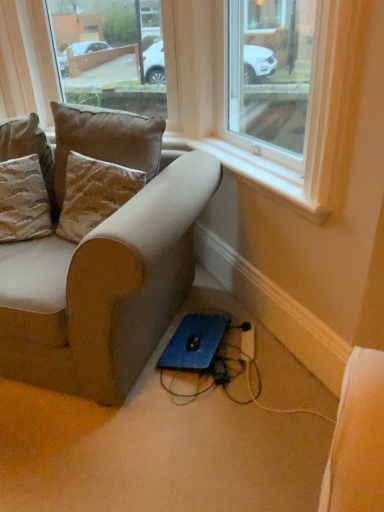
This screenshot has width=384, height=512. Describe the element at coordinates (257, 174) in the screenshot. I see `white plastic window sill at upper center` at that location.

Describe the element at coordinates (105, 140) in the screenshot. I see `velvet brown pillow at upper left, which is counted as the second pillow, starting from the left` at that location.

Locate an element on the screen. This screenshot has width=384, height=512. velvet brown pillow at upper left, which is counted as the second pillow, starting from the left is located at coordinates (105, 140).

Measure the distance between blue matte laptop at lower center and camera.

1.77 meters.

The image size is (384, 512). Identify the location of blue matte laptop at lower center. (194, 342).

From the picture: Measure the distance between point (289, 65) and camera.

They are 3.35 meters apart.

How much space does clear glass window at upper center, which ranks as the second window in right-to-left order, occupy vertically?

The height of clear glass window at upper center, which ranks as the second window in right-to-left order, is 27.56 inches.

The image size is (384, 512). Describe the element at coordinates (109, 53) in the screenshot. I see `clear glass window at upper center, which is the first window from left to right` at that location.

Identify the location of white plastic window sill at upper center. (257, 174).

From a real-world perspective, is clear glass window at upper center, arranged as the first window when viewed from the right, on blue matte laptop at lower center?

Yes.

Is clear glass window at upper center, positioned as the second window in left-to-right order, placed right next to blue matte laptop at lower center?

No, clear glass window at upper center, positioned as the second window in left-to-right order, is not touching blue matte laptop at lower center.

In order to click on window on the right of blue matte laptop at lower center in this screenshot , I will do click(x=275, y=78).

Is textured beige pillow at upper left, which is the second pillow from right to left, wider or thinner than clear glass window at upper center, which ranks as the second window in right-to-left order?

In the image, textured beige pillow at upper left, which is the second pillow from right to left, appears to be wider than clear glass window at upper center, which ranks as the second window in right-to-left order.

Which is more to the right, textured beige pillow at upper left, the first pillow in the left-to-right sequence, or clear glass window at upper center, which is the first window from left to right?

clear glass window at upper center, which is the first window from left to right, is more to the right.

Who is more distant, textured beige pillow at upper left, the first pillow in the left-to-right sequence, or clear glass window at upper center, which is the first window from left to right?

clear glass window at upper center, which is the first window from left to right, is more distant.

Is textured beige pillow at upper left, which is the second pillow from right to left, located outside clear glass window at upper center, which ranks as the second window in right-to-left order?

Yes, textured beige pillow at upper left, which is the second pillow from right to left, is not within clear glass window at upper center, which ranks as the second window in right-to-left order.

How many degrees apart are the facing directions of suede-like beige couch at lower left and textured beige pillow at upper left, which is the second pillow from right to left?

The angle between the facing direction of suede-like beige couch at lower left and the facing direction of textured beige pillow at upper left, which is the second pillow from right to left, is 24 degrees.

How much distance is there between suede-like beige couch at lower left and textured beige pillow at upper left, which is the second pillow from right to left?

A distance of 16.92 inches exists between suede-like beige couch at lower left and textured beige pillow at upper left, which is the second pillow from right to left.

Does suede-like beige couch at lower left contain textured beige pillow at upper left, the first pillow in the left-to-right sequence?

Yes, textured beige pillow at upper left, the first pillow in the left-to-right sequence, is inside suede-like beige couch at lower left.

Relative to textured beige pillow at upper left, the first pillow in the left-to-right sequence, is suede-like beige couch at lower left in front or behind?

suede-like beige couch at lower left is in front of textured beige pillow at upper left, the first pillow in the left-to-right sequence.

How distant is suede-like beige couch at lower left from clear glass window at upper center, arranged as the first window when viewed from the right?

suede-like beige couch at lower left and clear glass window at upper center, arranged as the first window when viewed from the right, are 4.76 feet apart from each other.

Considering the positions of objects suede-like beige couch at lower left and clear glass window at upper center, arranged as the first window when viewed from the right, in the image provided, who is more to the right, suede-like beige couch at lower left or clear glass window at upper center, arranged as the first window when viewed from the right,?

clear glass window at upper center, arranged as the first window when viewed from the right, is more to the right.

Does suede-like beige couch at lower left lie in front of clear glass window at upper center, positioned as the second window in left-to-right order?

No.

In terms of height, does suede-like beige couch at lower left look taller or shorter compared to clear glass window at upper center, positioned as the second window in left-to-right order?

In the image, suede-like beige couch at lower left appears to be taller than clear glass window at upper center, positioned as the second window in left-to-right order.

Considering the relative sizes of suede-like beige couch at lower left and white plastic window sill at upper center in the image provided, is suede-like beige couch at lower left wider than white plastic window sill at upper center?

Correct, the width of suede-like beige couch at lower left exceeds that of white plastic window sill at upper center.

From a real-world perspective, is suede-like beige couch at lower left physically below white plastic window sill at upper center?

Correct, in the physical world, suede-like beige couch at lower left is lower than white plastic window sill at upper center.

There is a suede-like beige couch at lower left. In order to click on window sill above it (from a real-world perspective) in this screenshot , I will do `click(257, 174)`.

From the image's perspective, is suede-like beige couch at lower left above or below white plastic window sill at upper center?

Based on their image positions, suede-like beige couch at lower left is located beneath white plastic window sill at upper center.

From the image's perspective, is white plastic window sill at upper center positioned above or below textured beige pillow at upper left, the first pillow in the left-to-right sequence?

Based on their image positions, white plastic window sill at upper center is located above textured beige pillow at upper left, the first pillow in the left-to-right sequence.

In terms of width, does white plastic window sill at upper center look wider or thinner when compared to textured beige pillow at upper left, which is the second pillow from right to left?

Clearly, white plastic window sill at upper center has less width compared to textured beige pillow at upper left, which is the second pillow from right to left.

Considering the sizes of objects white plastic window sill at upper center and textured beige pillow at upper left, the first pillow in the left-to-right sequence, in the image provided, who is shorter, white plastic window sill at upper center or textured beige pillow at upper left, the first pillow in the left-to-right sequence,?

Standing shorter between the two is white plastic window sill at upper center.

Can we say clear glass window at upper center, which ranks as the second window in right-to-left order, lies outside velvet brown pillow at upper left, which is counted as the second pillow, starting from the left?

clear glass window at upper center, which ranks as the second window in right-to-left order, is positioned outside velvet brown pillow at upper left, which is counted as the second pillow, starting from the left.

At what (x,y) coordinates should I click in order to perform the action: click on the 2nd pillow in front of the clear glass window at upper center, which is the first window from left to right, starting your count from the anchor. Please return your answer as a coordinate pair (x, y). Looking at the image, I should click on (105, 140).

Is clear glass window at upper center, which ranks as the second window in right-to-left order, facing away from velvet brown pillow at upper left, acting as the first pillow starting from the right?

No, velvet brown pillow at upper left, acting as the first pillow starting from the right, is not at the back of clear glass window at upper center, which ranks as the second window in right-to-left order.

Consider the image. From the image's perspective, which is below, clear glass window at upper center, which ranks as the second window in right-to-left order, or velvet brown pillow at upper left, which is counted as the second pillow, starting from the left?

velvet brown pillow at upper left, which is counted as the second pillow, starting from the left.

Image resolution: width=384 pixels, height=512 pixels. There is a blue matte laptop at lower center. Identify the location of the 1st window above it (from the image's perspective). (275, 78).

Where is `the 2nd pillow below the clear glass window at upper center, which is the first window from left to right (from the image's perspective)`? The image size is (384, 512). the 2nd pillow below the clear glass window at upper center, which is the first window from left to right (from the image's perspective) is located at coordinates (23, 200).

Considering their positions, is white plastic window sill at upper center positioned further to suede-like beige couch at lower left than black plastic extension cord at lower center?

Among the two, black plastic extension cord at lower center is located further to suede-like beige couch at lower left.

Estimate the real-world distances between objects in this image. Which object is closer to velvet brown pillow at upper left, which is counted as the second pillow, starting from the left, black plastic extension cord at lower center or clear glass window at upper center, arranged as the first window when viewed from the right?

black plastic extension cord at lower center is closer to velvet brown pillow at upper left, which is counted as the second pillow, starting from the left.

Estimate the real-world distances between objects in this image. Which object is further from textured beige pillow at upper left, the first pillow in the left-to-right sequence, suede-like beige couch at lower left or velvet brown pillow at upper left, which is counted as the second pillow, starting from the left?

suede-like beige couch at lower left is further to textured beige pillow at upper left, the first pillow in the left-to-right sequence.

Which object lies nearer to the anchor point white plastic window sill at upper center, blue matte laptop at lower center or textured beige pillow at upper left, which is the second pillow from right to left?

blue matte laptop at lower center is positioned closer to the anchor white plastic window sill at upper center.

From the image, which object appears to be farther from clear glass window at upper center, arranged as the first window when viewed from the right, velvet brown pillow at upper left, which is counted as the second pillow, starting from the left, or blue matte laptop at lower center?

blue matte laptop at lower center is positioned further to the anchor clear glass window at upper center, arranged as the first window when viewed from the right.

Looking at the image, which one is located closer to velvet brown pillow at upper left, acting as the first pillow starting from the right, white plastic window sill at upper center or blue matte laptop at lower center?

The object closer to velvet brown pillow at upper left, acting as the first pillow starting from the right, is white plastic window sill at upper center.

Which object lies nearer to the anchor point clear glass window at upper center, arranged as the first window when viewed from the right, black plastic extension cord at lower center or textured beige pillow at upper left, which is the second pillow from right to left?

textured beige pillow at upper left, which is the second pillow from right to left.

From the image, which object appears to be nearer to suede-like beige couch at lower left, textured beige pillow at upper left, the first pillow in the left-to-right sequence, or black plastic extension cord at lower center?

textured beige pillow at upper left, the first pillow in the left-to-right sequence.

At what (x,y) coordinates should I click in order to perform the action: click on window sill between clear glass window at upper center, which ranks as the second window in right-to-left order, and blue matte laptop at lower center in the up-down direction. Please return your answer as a coordinate pair (x, y). The height and width of the screenshot is (512, 384). Looking at the image, I should click on (257, 174).

Where is `studio couch between textured beige pillow at upper left, which is the second pillow from right to left, and blue matte laptop at lower center, in the horizontal direction`? studio couch between textured beige pillow at upper left, which is the second pillow from right to left, and blue matte laptop at lower center, in the horizontal direction is located at coordinates (104, 288).

The width and height of the screenshot is (384, 512). I want to click on window sill situated between textured beige pillow at upper left, which is the second pillow from right to left, and clear glass window at upper center, arranged as the first window when viewed from the right, from left to right, so click(257, 174).

This screenshot has width=384, height=512. Identify the location of computer between clear glass window at upper center, arranged as the first window when viewed from the right, and black plastic extension cord at lower center from top to bottom. (194, 342).